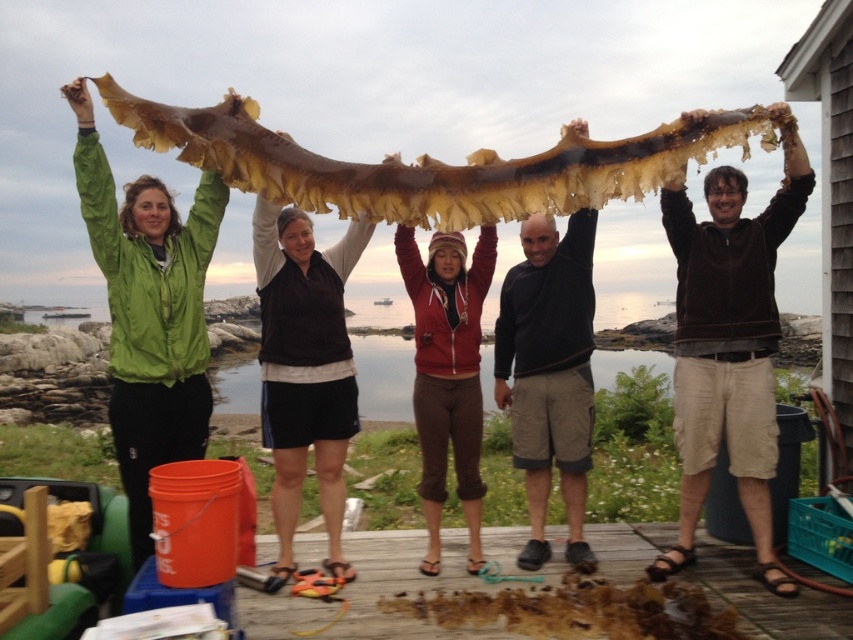
Question: Estimate the real-world distances between objects in this image. Which object is closer to the brown fuzzy sweater at upper right?

Choices:
 (A) dark gray sweater at center
 (B) smooth brown hair at upper center
 (C) smooth brown hair at center
 (D) matte green jacket at upper left

Answer: (B)

Question: Which of the following is the farthest from the observer?

Choices:
 (A) (125, 216)
 (B) (676, 304)
 (C) (312, 236)
 (D) (538, 260)

Answer: (D)

Question: Can you confirm if dark gray sweater at center is positioned to the left of smooth brown hair at upper center?

Choices:
 (A) yes
 (B) no

Answer: (A)

Question: Which object is positioned farthest from the brown fuzzy sweater at upper right?

Choices:
 (A) matte brown hair at center
 (B) knitted wool hat at center
 (C) dark gray sweater at center
 (D) smooth brown hair at upper center

Answer: (A)

Question: Is smooth brown hair at upper center further to the viewer compared to matte green jacket at upper left?

Choices:
 (A) no
 (B) yes

Answer: (B)

Question: Is brown fuzzy sweater at upper right bigger than matte brown hair at center?

Choices:
 (A) no
 (B) yes

Answer: (B)